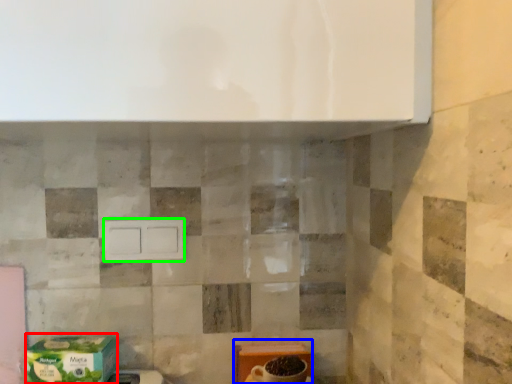
Question: Which is farther away from cardboard box (highlighted by a red box)? cardboard box (highlighted by a blue box) or drawer (highlighted by a green box)?

Choices:
 (A) cardboard box
 (B) drawer

Answer: (A)